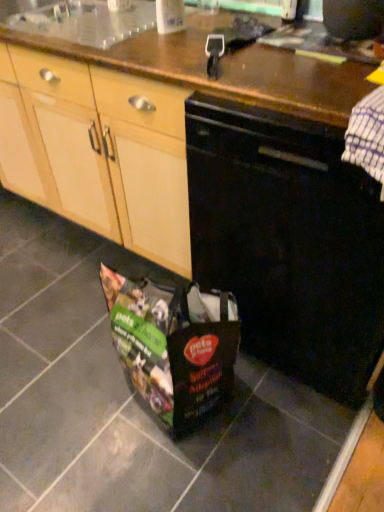
Measure the distance between white glossy container at upper center and camera.

They are 1.28 meters apart.

Describe the element at coordinates (170, 16) in the screenshot. I see `white glossy container at upper center` at that location.

The image size is (384, 512). I want to click on white glossy container at upper center, so click(x=170, y=16).

Identify the location of black matte dishwasher at center. This screenshot has width=384, height=512. (288, 241).

Image resolution: width=384 pixels, height=512 pixels. Describe the element at coordinates (288, 241) in the screenshot. I see `black matte dishwasher at center` at that location.

Image resolution: width=384 pixels, height=512 pixels. In order to click on white glossy container at upper center in this screenshot , I will do `click(170, 16)`.

Which is more to the left, black matte dishwasher at center or white glossy container at upper center?

white glossy container at upper center.

Which object is closer to the camera, black matte dishwasher at center or white glossy container at upper center?

black matte dishwasher at center is more forward.

Considering the points (272, 143) and (168, 7), which point is in front, point (272, 143) or point (168, 7)?

Positioned in front is point (272, 143).

From the image's perspective, is black matte dishwasher at center over white glossy container at upper center?

No, from the image's perspective, black matte dishwasher at center is not above white glossy container at upper center.

Looking at this image, from a real-world perspective, between black matte dishwasher at center and white glossy container at upper center, who is vertically lower?

black matte dishwasher at center.

Can you confirm if black matte dishwasher at center is thinner than white glossy container at upper center?

No, black matte dishwasher at center is not thinner than white glossy container at upper center.

Considering the relative sizes of black matte dishwasher at center and white glossy container at upper center in the image provided, is black matte dishwasher at center taller than white glossy container at upper center?

Indeed, black matte dishwasher at center has a greater height compared to white glossy container at upper center.

Who is smaller, black matte dishwasher at center or white glossy container at upper center?

Smaller between the two is white glossy container at upper center.

Is black matte dishwasher at center completely or partially outside of white glossy container at upper center?

black matte dishwasher at center lies outside white glossy container at upper center's area.

Is black matte dishwasher at center placed right next to white glossy container at upper center?

black matte dishwasher at center and white glossy container at upper center are clearly separated.

Could you tell me if black matte dishwasher at center is turned towards white glossy container at upper center?

No, black matte dishwasher at center does not turn towards white glossy container at upper center.

How many degrees apart are the facing directions of black matte dishwasher at center and white glossy container at upper center?

black matte dishwasher at center and white glossy container at upper center are facing 0.000609 degrees away from each other.

Where is `home appliance that is below the white glossy container at upper center (from the image's perspective)`? The height and width of the screenshot is (512, 384). home appliance that is below the white glossy container at upper center (from the image's perspective) is located at coordinates (288, 241).

Consider the image. Which is more to the right, white glossy container at upper center or black matte dishwasher at center?

black matte dishwasher at center.

Relative to black matte dishwasher at center, is white glossy container at upper center in front or behind?

white glossy container at upper center is positioned farther from the viewer than black matte dishwasher at center.

Considering the points (166, 29) and (269, 277), which point is in front, point (166, 29) or point (269, 277)?

The point (269, 277) is more forward.

Based on the photo, from the image's perspective, is white glossy container at upper center located above or below black matte dishwasher at center?

white glossy container at upper center is above black matte dishwasher at center.

From a real-world perspective, is white glossy container at upper center below black matte dishwasher at center?

No.

Does white glossy container at upper center have a lesser width compared to black matte dishwasher at center?

Indeed, white glossy container at upper center has a lesser width compared to black matte dishwasher at center.

Which of these two, white glossy container at upper center or black matte dishwasher at center, stands shorter?

With less height is white glossy container at upper center.

Who is bigger, white glossy container at upper center or black matte dishwasher at center?

black matte dishwasher at center is bigger.

Is white glossy container at upper center not within black matte dishwasher at center?

white glossy container at upper center lies outside black matte dishwasher at center's area.

Are white glossy container at upper center and black matte dishwasher at center far apart?

No, white glossy container at upper center is in close proximity to black matte dishwasher at center.

Is white glossy container at upper center looking in the opposite direction of black matte dishwasher at center?

white glossy container at upper center is not turned away from black matte dishwasher at center.

Can you tell me how much white glossy container at upper center and black matte dishwasher at center differ in facing direction?

The angular difference between white glossy container at upper center and black matte dishwasher at center is 0.000609 degrees.

Where is `kitchen appliance behind the black matte dishwasher at center`? The height and width of the screenshot is (512, 384). kitchen appliance behind the black matte dishwasher at center is located at coordinates (170, 16).

The width and height of the screenshot is (384, 512). I want to click on kitchen appliance lying above the black matte dishwasher at center (from the image's perspective), so click(x=170, y=16).

Where is `home appliance in front of the white glossy container at upper center`? This screenshot has height=512, width=384. home appliance in front of the white glossy container at upper center is located at coordinates (288, 241).